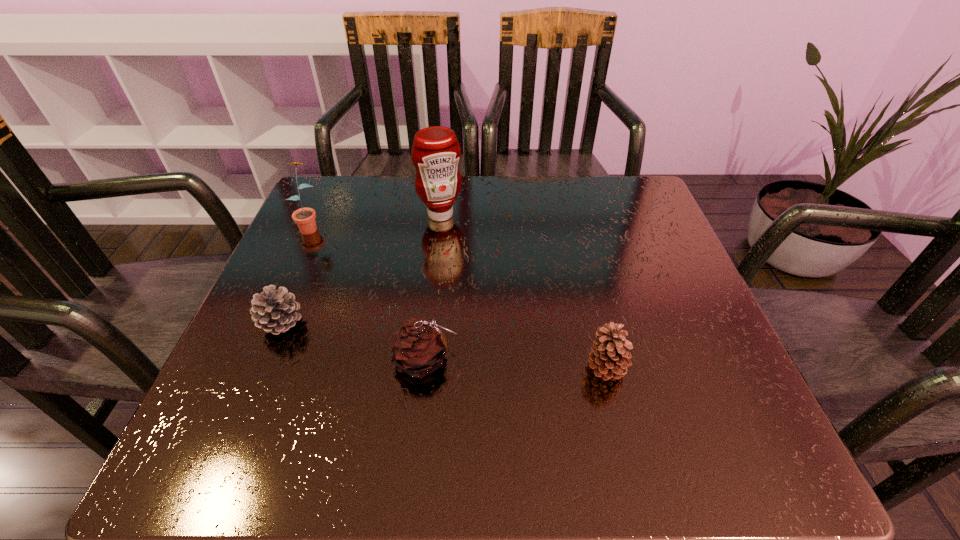
Where is `vacant area situated 0.100m on the back of the leftmost pinecone`? This screenshot has width=960, height=540. vacant area situated 0.100m on the back of the leftmost pinecone is located at coordinates (302, 272).

Identify the location of condiment positioned at the far edge. The height and width of the screenshot is (540, 960). (436, 152).

Identify the location of sunflower situated at the far edge. (305, 217).

Where is `sunflower situated at the left edge`? The height and width of the screenshot is (540, 960). sunflower situated at the left edge is located at coordinates pos(305,217).

Where is `pinecone at the left edge`? The image size is (960, 540). pinecone at the left edge is located at coordinates (273, 310).

Where is `object that is at the far left corner`? This screenshot has width=960, height=540. object that is at the far left corner is located at coordinates (305, 217).

In the image, there is a desktop. At what (x,y) coordinates should I click in order to perform the action: click on vacant space at the far edge. Please return your answer as a coordinate pair (x, y). This screenshot has width=960, height=540. Looking at the image, I should click on (489, 191).

At what (x,y) coordinates should I click in order to perform the action: click on vacant region at the near edge of the desktop. Please return your answer as a coordinate pair (x, y). This screenshot has height=540, width=960. Looking at the image, I should click on (470, 433).

This screenshot has width=960, height=540. Identify the location of vacant area at the left edge of the desktop. (221, 387).

Locate an element on the screen. This screenshot has height=540, width=960. free space at the right edge of the desktop is located at coordinates (664, 349).